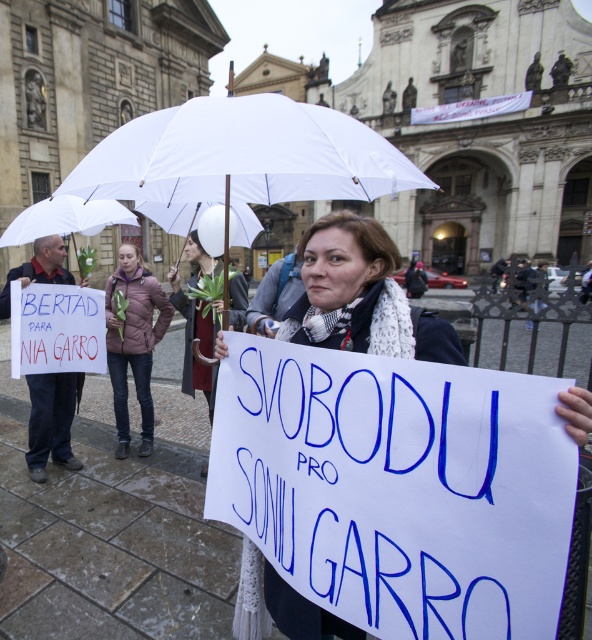
Can you confirm if white paper sign at center is positioned to the left of white fabric umbrella at upper center?

No, white paper sign at center is not to the left of white fabric umbrella at upper center.

Does white paper sign at center lie in front of white fabric umbrella at upper center?

Yes, white paper sign at center is closer to the viewer.

Based on the photo, who is more forward, (349,276) or (184,374)?

Point (349,276)

You are a GUI agent. You are given a task and a screenshot of the screen. Output one action in this format:
    pyautogui.click(x=<x>, y=<y>)
    Task: Click on the white paper sign at center
    The width and height of the screenshot is (592, 640).
    Given the screenshot: What is the action you would take?
    pyautogui.click(x=358, y=294)

Who is positioned more to the left, white matte umbrella at center or purple down jacket at center?

purple down jacket at center is more to the left.

Can you confirm if white matte umbrella at center is taller than purple down jacket at center?

Correct, white matte umbrella at center is much taller as purple down jacket at center.

I want to click on white matte umbrella at center, so click(x=243, y=156).

Can you confirm if white paper sign at center is positioned below purple down jacket at center?

No, white paper sign at center is not below purple down jacket at center.

Does white paper sign at center have a greater width compared to purple down jacket at center?

No, white paper sign at center is not wider than purple down jacket at center.

Is point (430, 333) more distant than point (152, 433)?

No.

What are the coordinates of `white paper sign at center` in the screenshot? It's located at (358, 294).